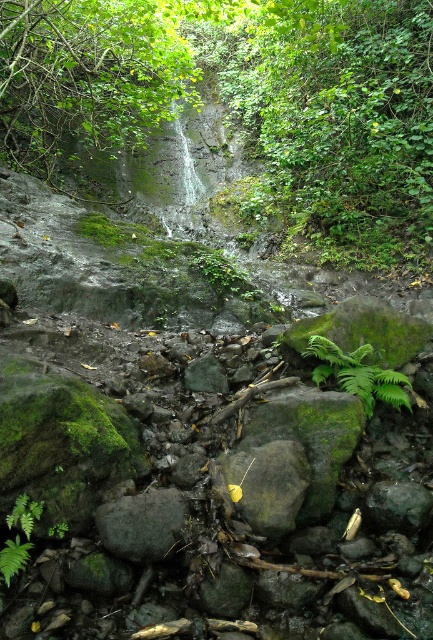
You are standing at the base of the waterfall in the serene natural scene. You notice a point marked at coordinates (87, 77). What object is located at that point?

The point at coordinates (87, 77) indicates a green leafy tree at upper center.

You are a hiker who wants to place a small water bottle between the green mossy rock at center and the green leafy fern at center. Which object should you place the bottle closer to if you want it to be closer to the smaller object?

You should place the bottle closer to the green mossy rock at center because it is smaller than the green leafy fern at center.